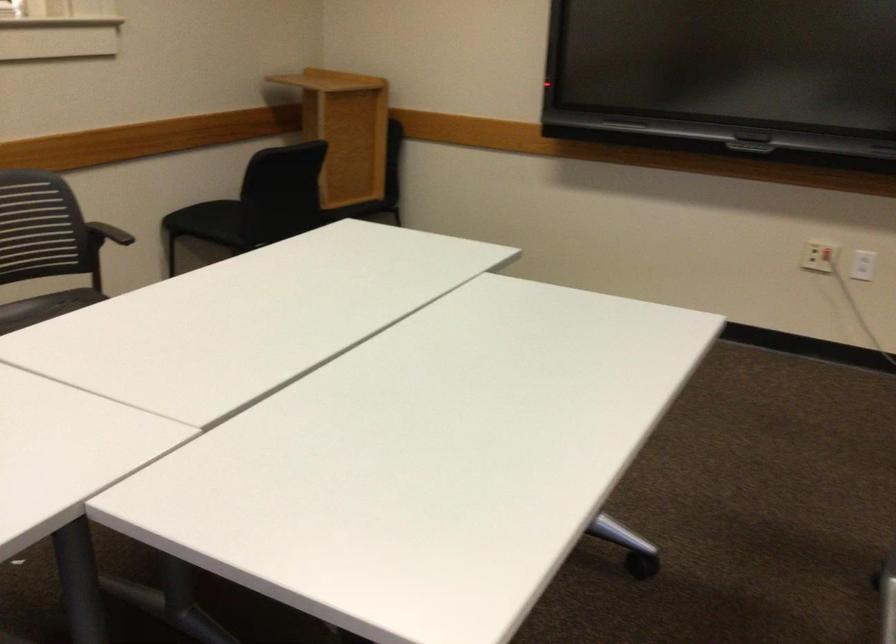
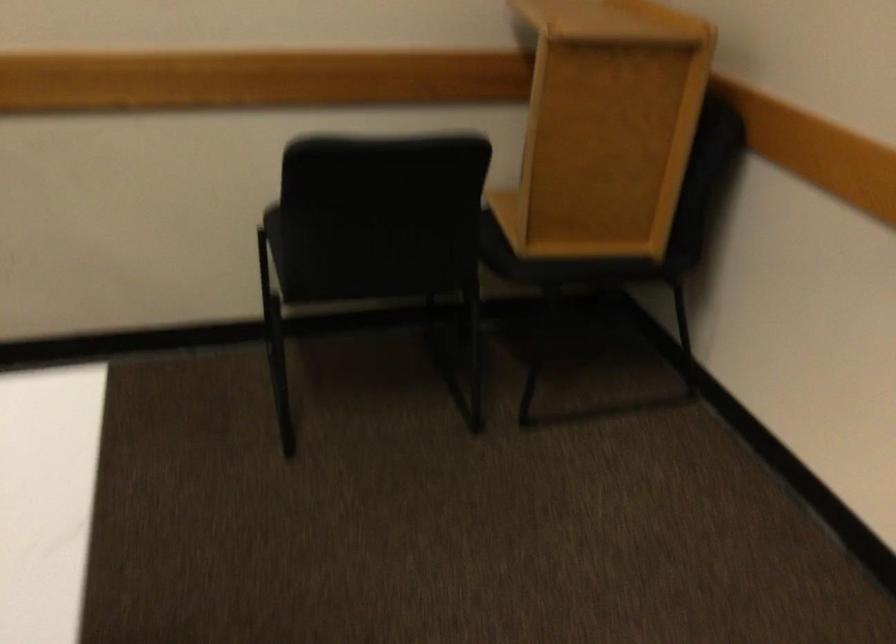
Find the pixel in the second image that matches (357,128) in the first image.

(605, 127)